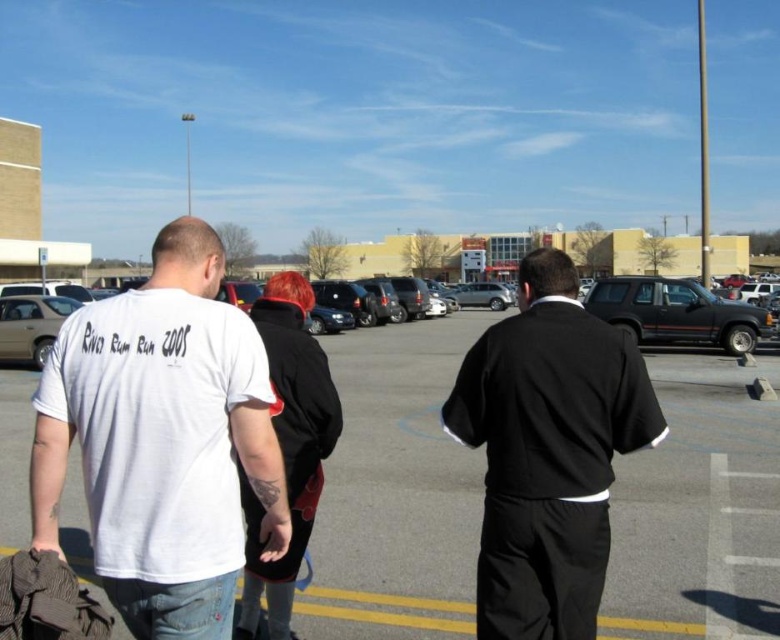
You are a security guard at the commercial building and need to check the items carried by both the black smooth suit at center and the black leather jacket at center. Which one should you approach first if you want to check the person on the left side first?

The black leather jacket at center is on the left side of the black smooth suit at center, so you should approach the black leather jacket at center first to check the person on the left side.

You are a delivery person needing to park your van between the black matte suv at right and the matte silver sedan at left. Given that your van is 6 meters long, can you fit it in the space between them?

The black matte suv at right is larger than the matte silver sedan at left, but the description does not provide the exact distance between them. Without knowing the available space, it is impossible to determine if the van will fit.